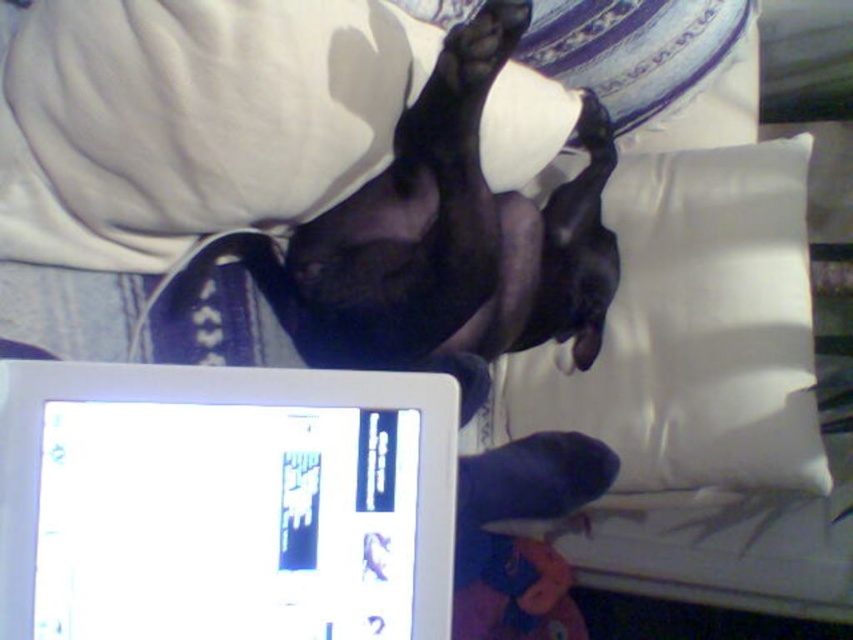
Looking at this image, between satin white pillow at upper right and black smooth dog at center, which one has more height?

Standing taller between the two is satin white pillow at upper right.

Who is higher up, satin white pillow at upper right or black smooth dog at center?

Answer: black smooth dog at center is higher up.

The image size is (853, 640). I want to click on satin white pillow at upper right, so click(692, 330).

Between point (325, 552) and point (422, 312), which one is positioned in front?

Positioned in front is point (325, 552).

Which of these two, white glossy tablet at lower left or black smooth dog at center, stands shorter?

Standing shorter between the two is white glossy tablet at lower left.

Who is more distant from viewer, [32,461] or [498,312]?

Point [498,312]

This screenshot has width=853, height=640. I want to click on white glossy tablet at lower left, so click(224, 502).

Is black smooth dog at center smaller than black matte paw at upper center?

No, black smooth dog at center is not smaller than black matte paw at upper center.

I want to click on black smooth dog at center, so click(x=457, y=232).

Is point (590, 212) positioned after point (456, 65)?

Yes.

I want to click on black smooth dog at center, so click(x=457, y=232).